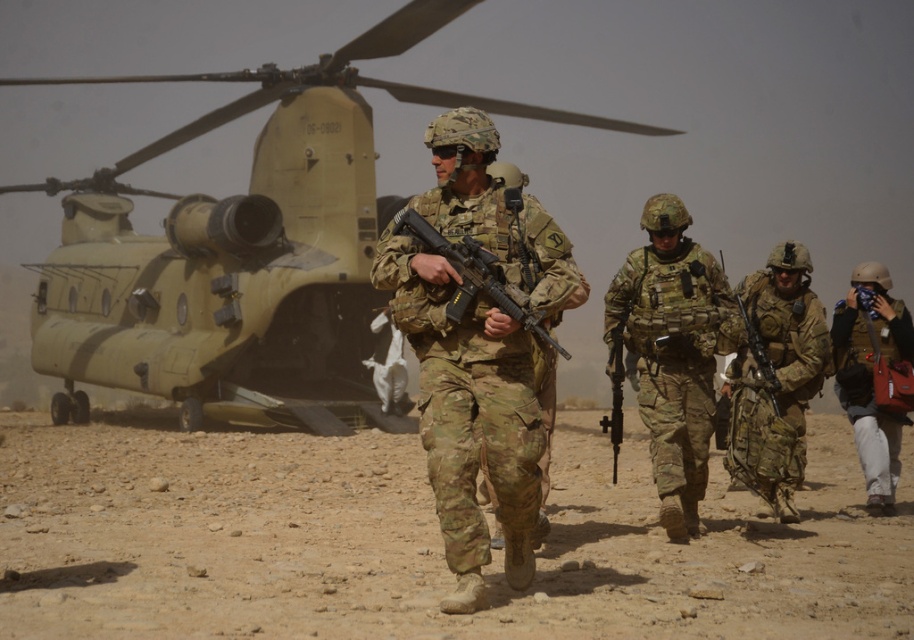
Which is in front, point (652, 380) or point (787, 388)?

Positioned in front is point (652, 380).

Who is more distant from viewer, (672,340) or (780,419)?

Positioned behind is point (780,419).

Is point (675, 388) farther from camera compared to point (817, 308)?

That is False.

Image resolution: width=914 pixels, height=640 pixels. Find the location of `camouflage fabric uniform at center`. camouflage fabric uniform at center is located at coordinates (671, 353).

Is dusty brown terrain at center wider than camouflage uniform at center?

Yes.

Between dusty brown terrain at center and camouflage uniform at center, which one has more height?

With more height is camouflage uniform at center.

Locate an element on the screen. The image size is (914, 640). dusty brown terrain at center is located at coordinates (417, 541).

Where is `dusty brown terrain at center`? This screenshot has height=640, width=914. dusty brown terrain at center is located at coordinates tap(417, 541).

Based on the photo, who is higher up, dusty brown terrain at center or camouflage fabric uniform at center?

camouflage fabric uniform at center is above.

Is dusty brown terrain at center wider than camouflage fabric uniform at center?

Yes, dusty brown terrain at center is wider than camouflage fabric uniform at center.

In order to click on dusty brown terrain at center in this screenshot , I will do `click(417, 541)`.